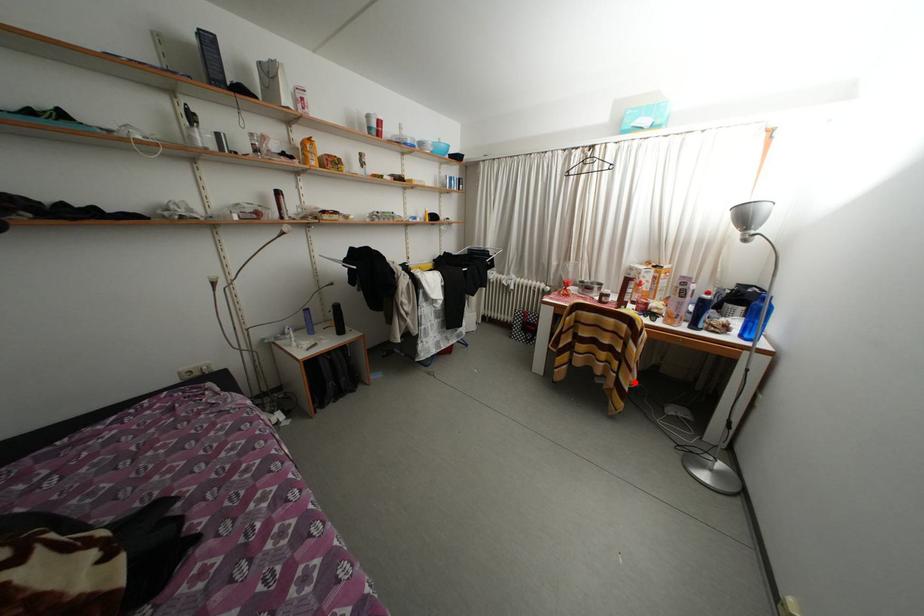
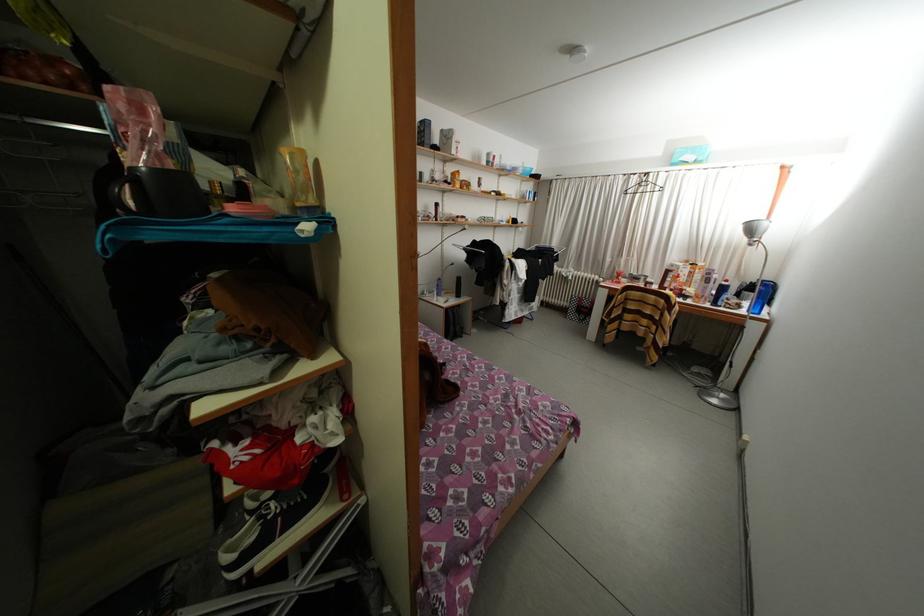
Question: I am providing you with two images of the same scene from different viewpoints. Given a red point in image1, look at the same physical point in image2. Is it:

Choices:
 (A) Closer to the viewpoint
 (B) Farther from the viewpoint

Answer: (A)